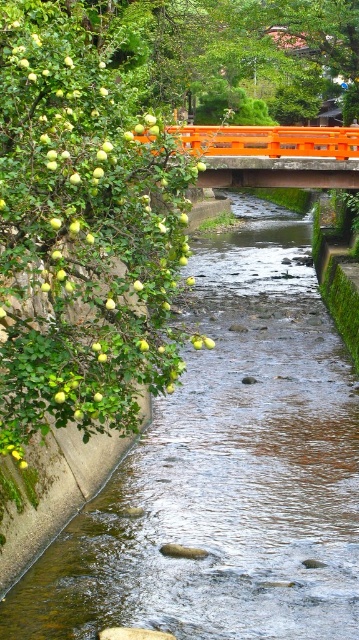
Question: From the image, what is the correct spatial relationship of clear water at stream center in relation to orange painted wooden bridge at center?

Choices:
 (A) left
 (B) right

Answer: (A)

Question: Among these points, which one is farthest from the camera?

Choices:
 (A) (316, 129)
 (B) (202, 474)

Answer: (A)

Question: Does clear water at stream center have a smaller size compared to orange painted wooden bridge at center?

Choices:
 (A) no
 (B) yes

Answer: (B)

Question: Is clear water at stream center to the right of orange painted wooden bridge at center from the viewer's perspective?

Choices:
 (A) no
 (B) yes

Answer: (A)

Question: Which of the following is the closest to the observer?

Choices:
 (A) (344, 163)
 (B) (174, 428)

Answer: (B)